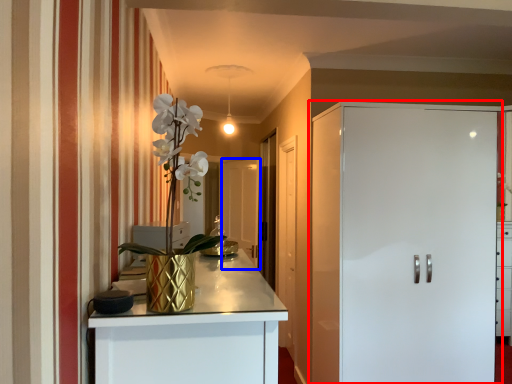
Question: Among these objects, which one is nearest to the camera, door (highlighted by a red box) or glass door (highlighted by a blue box)?

Choices:
 (A) door
 (B) glass door

Answer: (A)